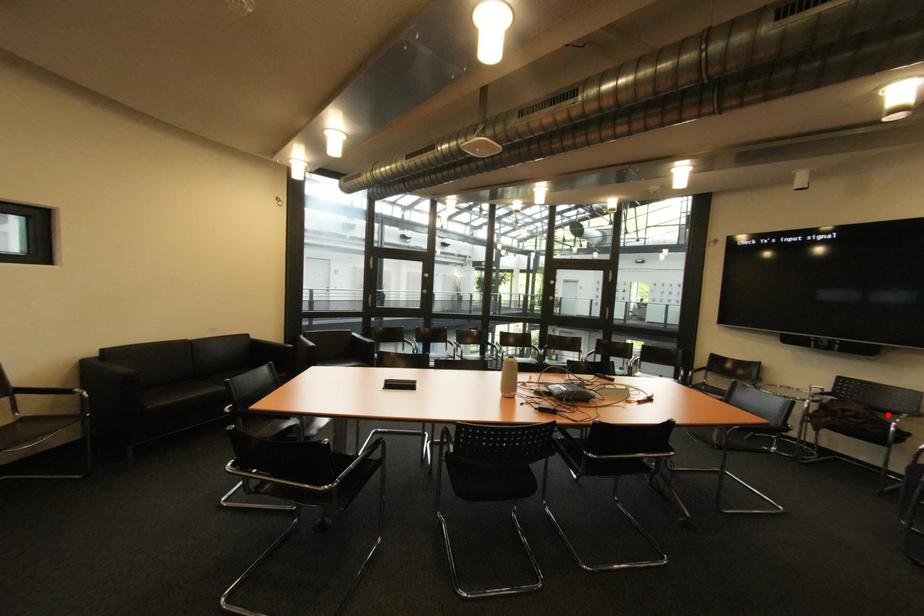
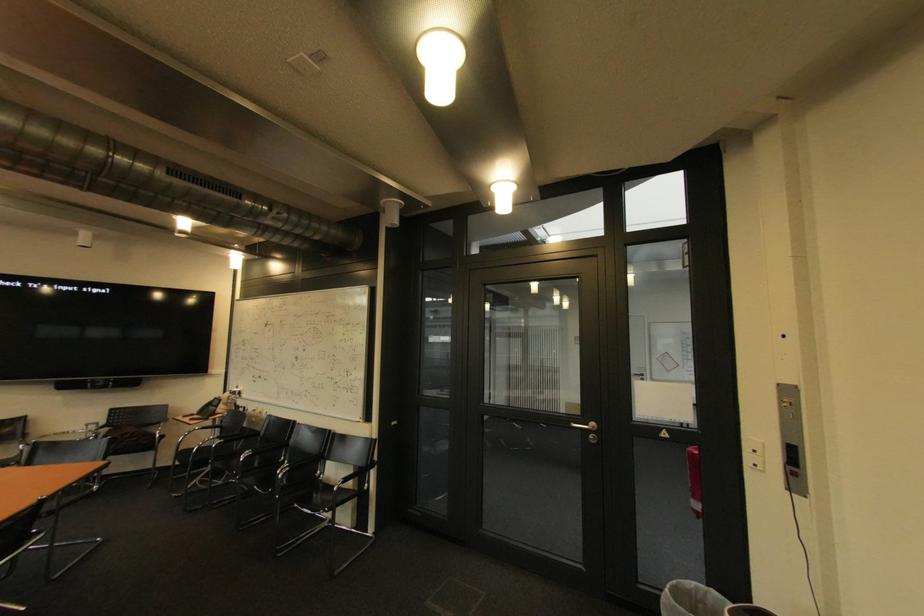
Where in the second image is the point corresponding to the highlighted location from the first image?

(152, 430)